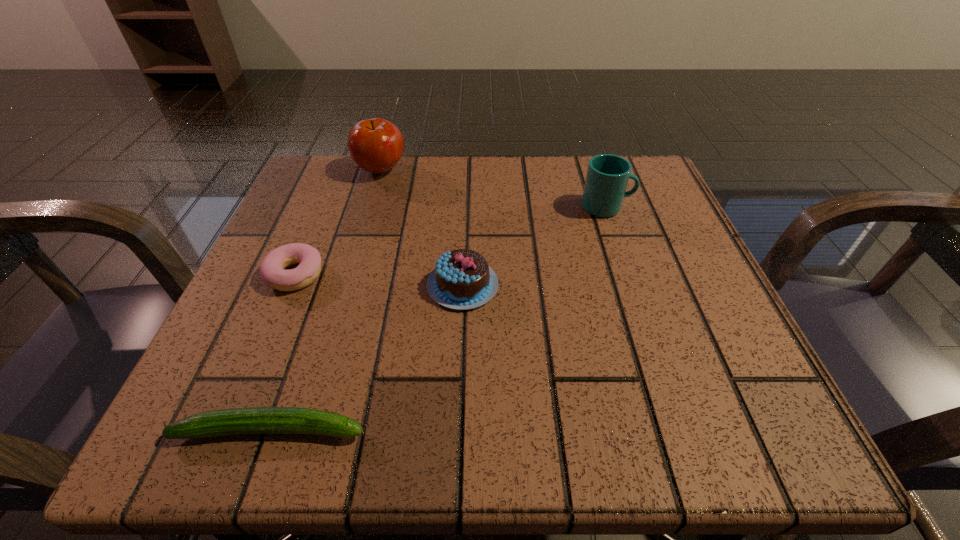
At what (x,y) coordinates should I click in order to perform the action: click on object located in the right edge section of the desktop. Please return your answer as a coordinate pair (x, y). The image size is (960, 540). Looking at the image, I should click on (607, 176).

Where is `object at the far left corner`? This screenshot has width=960, height=540. object at the far left corner is located at coordinates (376, 145).

Find the location of a particular element. object located at the near left corner is located at coordinates (255, 420).

You are a GUI agent. You are given a task and a screenshot of the screen. Output one action in this format:
    pyautogui.click(x=<x>, y=<y>)
    Task: Click on the object at the far right corner
    The height and width of the screenshot is (540, 960).
    Given the screenshot: What is the action you would take?
    pyautogui.click(x=607, y=176)

I want to click on blank space at the far edge, so click(432, 211).

In the image, there is a desktop. At what (x,y) coordinates should I click in order to perform the action: click on vacant space at the near edge. Please return your answer as a coordinate pair (x, y). Looking at the image, I should click on point(611,446).

I want to click on free space at the left edge of the desktop, so click(255, 334).

The image size is (960, 540). I want to click on vacant space at the right edge of the desktop, so click(x=627, y=244).

The height and width of the screenshot is (540, 960). Find the location of `vacant space at the far left corner`. vacant space at the far left corner is located at coordinates (314, 168).

In the image, there is a desktop. Where is `free space at the near left corner`? The width and height of the screenshot is (960, 540). free space at the near left corner is located at coordinates (300, 388).